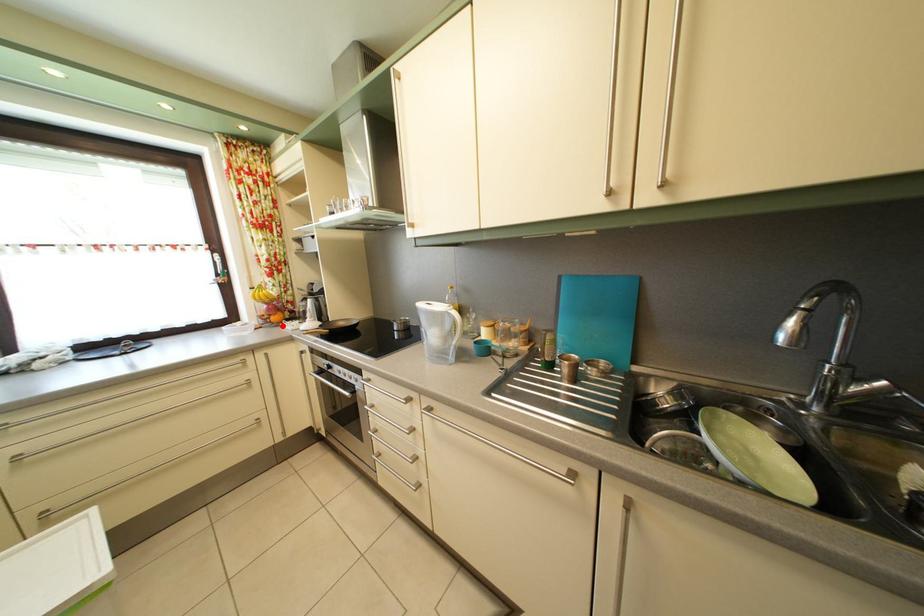
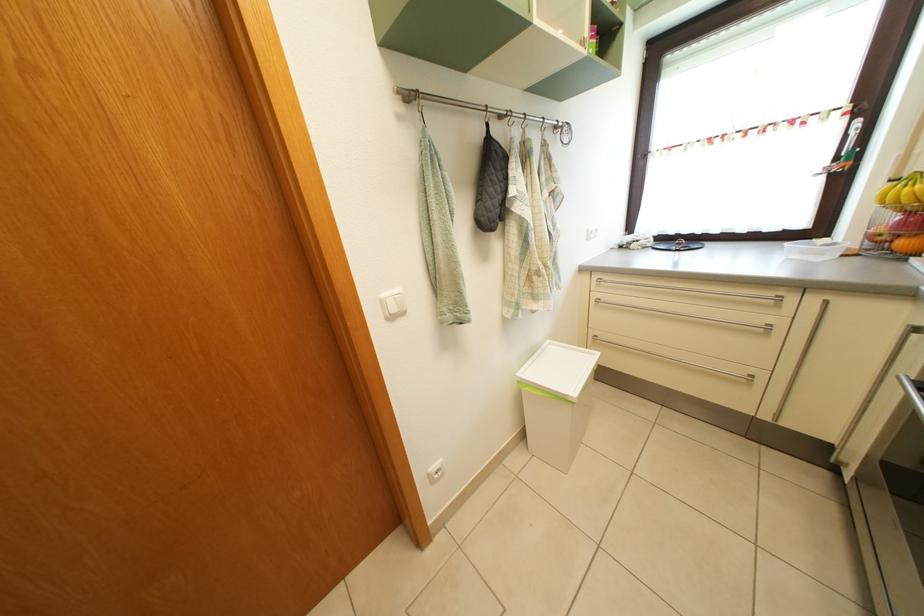
Question: I am providing you with two images of the same scene from different viewpoints. In image1, a red point is highlighted. Considering the same 3D point in image2, which of the following is correct?

Choices:
 (A) It is closer
 (B) It is farther

Answer: (B)